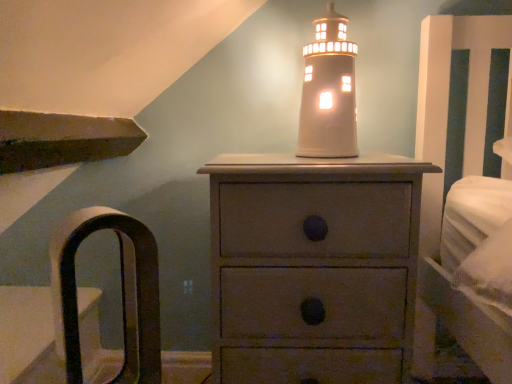
The width and height of the screenshot is (512, 384). Find the location of `brown leather armchair at left`. brown leather armchair at left is located at coordinates (122, 293).

Image resolution: width=512 pixels, height=384 pixels. Describe the element at coordinates (122, 293) in the screenshot. I see `brown leather armchair at left` at that location.

Describe the element at coordinates (328, 92) in the screenshot. I see `white ceramic lighthouse at center` at that location.

In order to face matte gray chest of drawers at center, should I rotate leftwards or rightwards?

You should look right and rotate roughly 7.041 degrees.

I want to click on brown leather armchair at left, so click(x=122, y=293).

Is white ceramic lighthouse at center next to matte gray chest of drawers at center?

No, white ceramic lighthouse at center is not making contact with matte gray chest of drawers at center.

From a real-world perspective, which object stands above the other?

In real-world perspective, white ceramic lighthouse at center is above.

How distant is white ceramic lighthouse at center from matte gray chest of drawers at center?

A distance of 10.43 inches exists between white ceramic lighthouse at center and matte gray chest of drawers at center.

From the image's perspective, which one is positioned higher, white ceramic lighthouse at center or matte gray chest of drawers at center?

white ceramic lighthouse at center is shown above in the image.

From the image's perspective, is brown leather armchair at left beneath matte gray chest of drawers at center?

Incorrect, from the image's perspective, brown leather armchair at left is higher than matte gray chest of drawers at center.

Which of these two, brown leather armchair at left or matte gray chest of drawers at center, is thinner?

With smaller width is brown leather armchair at left.

How many degrees apart are the facing directions of white ceramic lighthouse at center and brown leather armchair at left?

They differ by 40 degrees in their facing directions.

From a real-world perspective, who is located higher, white ceramic lighthouse at center or brown leather armchair at left?

In real-world perspective, white ceramic lighthouse at center is above.

Would you say white ceramic lighthouse at center is a long distance from brown leather armchair at left?

No, there isn't a large distance between white ceramic lighthouse at center and brown leather armchair at left.

Considering the sizes of objects white ceramic lighthouse at center and brown leather armchair at left in the image provided, who is wider, white ceramic lighthouse at center or brown leather armchair at left?

With larger width is brown leather armchair at left.

Which of these two, matte gray chest of drawers at center or brown leather armchair at left, is thinner?

brown leather armchair at left is thinner.

Which point is more distant from viewer, (234,267) or (142,297)?

The point (234,267) is farther from the camera.

Find the location of a particular element. Image resolution: width=512 pixels, height=384 pixels. armchair that is in front of the matte gray chest of drawers at center is located at coordinates (122, 293).

Which object is wider, brown leather armchair at left or white ceramic lighthouse at center?

brown leather armchair at left is wider.

Considering the relative sizes of brown leather armchair at left and white ceramic lighthouse at center in the image provided, is brown leather armchair at left bigger than white ceramic lighthouse at center?

Yes.

Find the location of a particular element. The width and height of the screenshot is (512, 384). armchair that appears in front of the white ceramic lighthouse at center is located at coordinates (122, 293).

Is matte gray chest of drawers at center beside white ceramic lighthouse at center?

There is a gap between matte gray chest of drawers at center and white ceramic lighthouse at center.

Is matte gray chest of drawers at center facing away from white ceramic lighthouse at center?

matte gray chest of drawers at center is not turned away from white ceramic lighthouse at center.

From the image's perspective, is matte gray chest of drawers at center below white ceramic lighthouse at center?

Yes.

Is point (358, 326) closer or farther from the camera than point (309, 81)?

Point (358, 326).

The height and width of the screenshot is (384, 512). In order to click on the chest of drawers in front of the white ceramic lighthouse at center in this screenshot , I will do `click(313, 267)`.

Locate an element on the screen. armchair above the matte gray chest of drawers at center (from a real-world perspective) is located at coordinates (122, 293).

From the image, which object appears to be farther from brown leather armchair at left, matte gray chest of drawers at center or white ceramic lighthouse at center?

The object further to brown leather armchair at left is white ceramic lighthouse at center.

Looking at the image, which one is located closer to brown leather armchair at left, white ceramic lighthouse at center or matte gray chest of drawers at center?

matte gray chest of drawers at center is positioned closer to the anchor brown leather armchair at left.

Based on their spatial positions, is white ceramic lighthouse at center or brown leather armchair at left closer to matte gray chest of drawers at center?

white ceramic lighthouse at center.

Based on their spatial positions, is brown leather armchair at left or matte gray chest of drawers at center closer to white ceramic lighthouse at center?

matte gray chest of drawers at center lies closer to white ceramic lighthouse at center than the other object.

Which object lies further to the anchor point matte gray chest of drawers at center, brown leather armchair at left or white ceramic lighthouse at center?

Among the two, brown leather armchair at left is located further to matte gray chest of drawers at center.

Estimate the real-world distances between objects in this image. Which object is closer to white ceramic lighthouse at center, matte gray chest of drawers at center or brown leather armchair at left?

matte gray chest of drawers at center lies closer to white ceramic lighthouse at center than the other object.

At what (x,y) coordinates should I click in order to perform the action: click on armchair between white ceramic lighthouse at center and matte gray chest of drawers at center vertically. Please return your answer as a coordinate pair (x, y). Looking at the image, I should click on (122, 293).